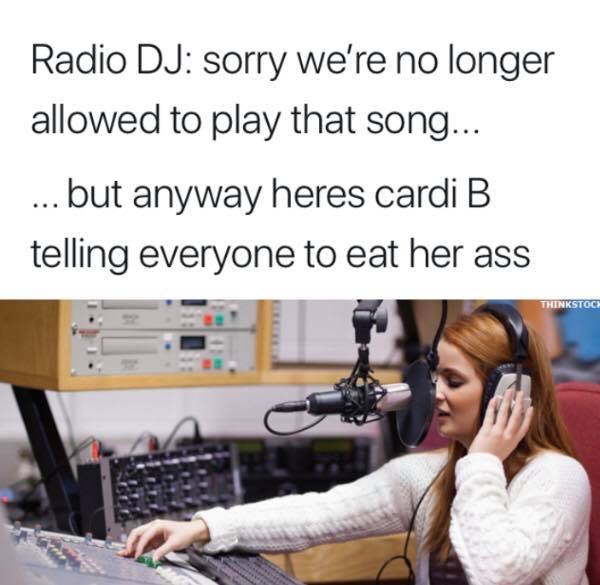
Find the location of `wooden shelving`. wooden shelving is located at coordinates (345, 555), (300, 375), (33, 343).